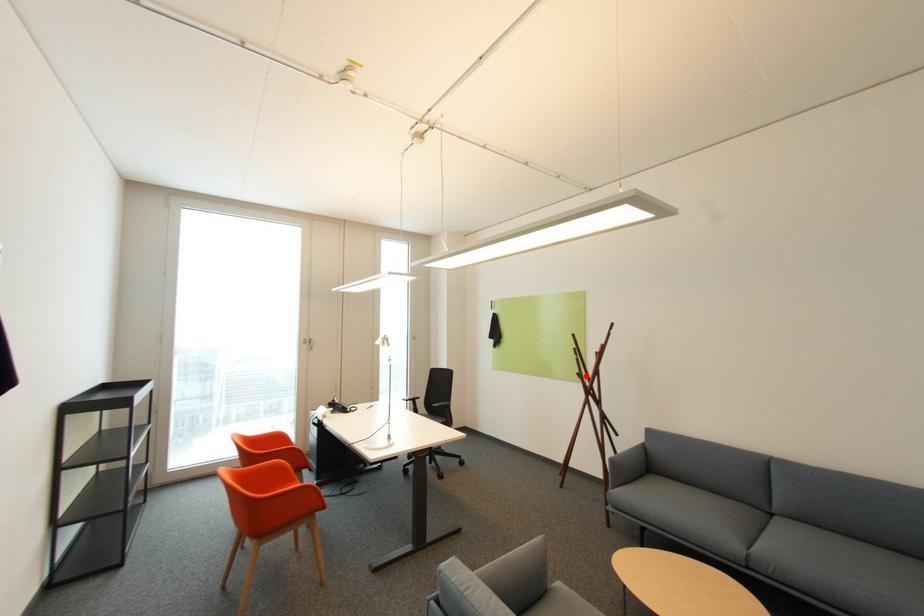
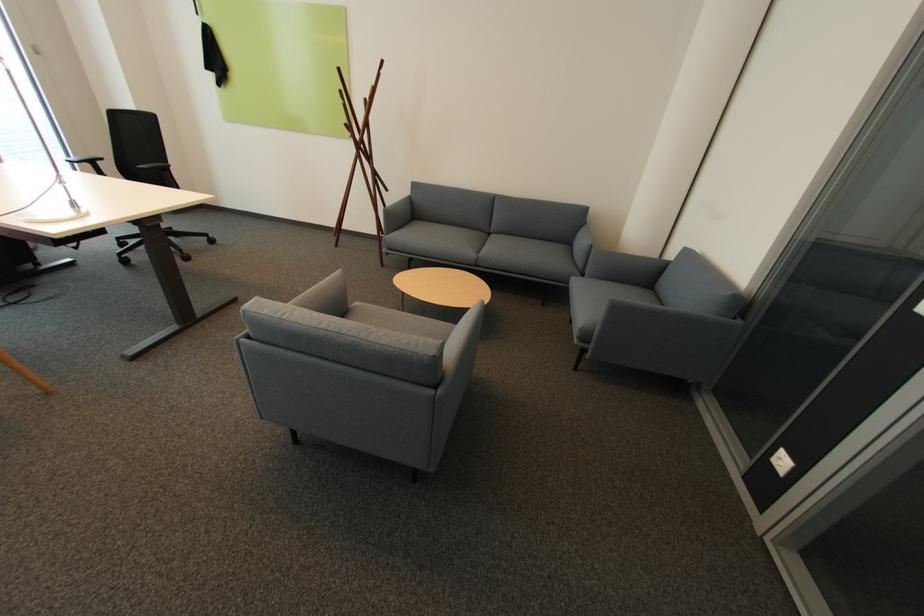
Question: A red point is marked in image1. In image2, is the corresponding 3D point closer to the camera or farther? Reply with the corresponding letter.

Choices:
 (A) The corresponding 3D point is closer.
 (B) The corresponding 3D point is farther.

Answer: (A)